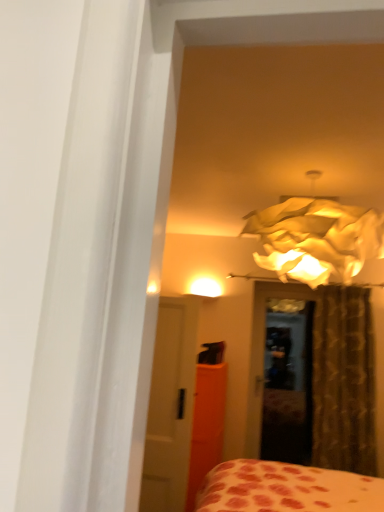
Question: Is matte paper lampshade at upper center in front of or behind orange matte armoire at center in the image?

Choices:
 (A) front
 (B) behind

Answer: (A)

Question: Based on their positions, is matte paper lampshade at upper center located to the left or right of orange matte armoire at center?

Choices:
 (A) left
 (B) right

Answer: (B)

Question: Estimate the real-world distances between objects in this image. Which object is closer to the matte paper lampshade at upper center?

Choices:
 (A) brown textured curtain at right
 (B) orange matte armoire at center
 (C) white glossy door at center

Answer: (C)

Question: Which of these objects is positioned closest to the orange matte armoire at center?

Choices:
 (A) matte paper lampshade at upper center
 (B) white glossy door at center
 (C) brown textured curtain at right

Answer: (B)